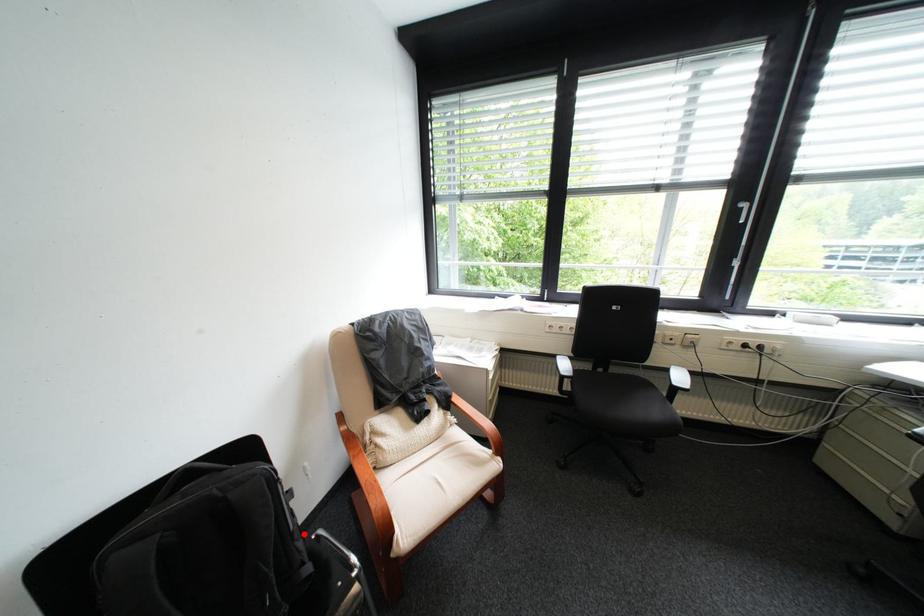
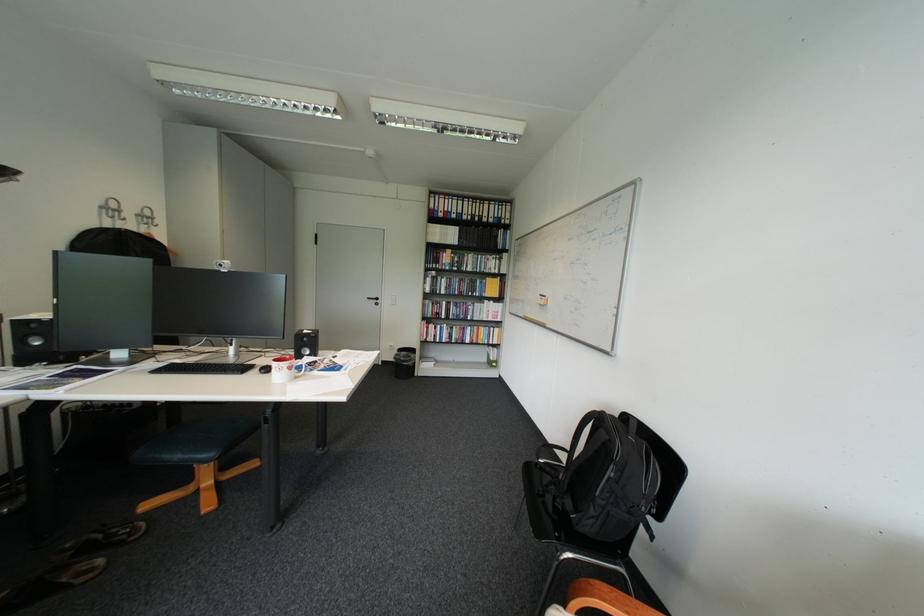
In the second image, find the point that corresponds to the highlighted location in the first image.

(608, 496)